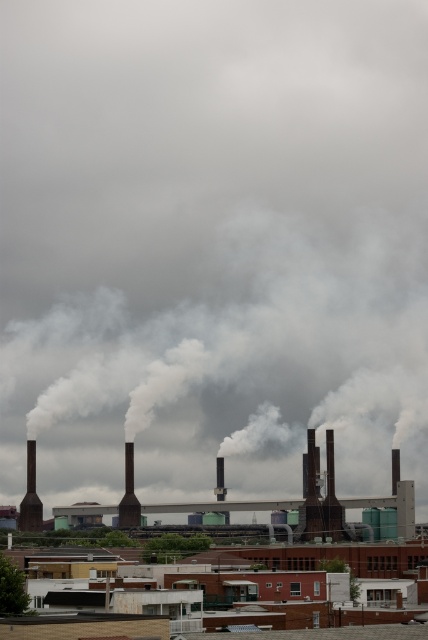
Question: Among these objects, which one is farthest from the camera?

Choices:
 (A) black matte chimney at center
 (B) smooth metallic chimney at center

Answer: (A)

Question: Is dark brown brick chimney at left to the left of green matte plant at center from the viewer's perspective?

Choices:
 (A) no
 (B) yes

Answer: (B)

Question: Is brown industrial building at center to the left of smooth metallic chimney at center from the viewer's perspective?

Choices:
 (A) yes
 (B) no

Answer: (A)

Question: Is white smoke at center smaller than dark brown brick chimney at left?

Choices:
 (A) no
 (B) yes

Answer: (A)

Question: Which of these objects is positioned closest to the smooth metallic chimney at center?

Choices:
 (A) white smoke at center
 (B) green matte plant at center
 (C) brown industrial building at center
 (D) black matte chimney at center

Answer: (D)

Question: Among these objects, which one is nearest to the camera?

Choices:
 (A) white smoke at center
 (B) green matte plant at center

Answer: (B)